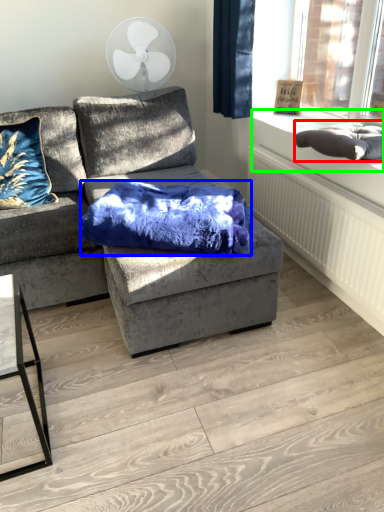
Question: Estimate the real-world distances between objects in this image. Which object is closer to material (highlighted by a red box), blanket (highlighted by a blue box) or window sill (highlighted by a green box)?

Choices:
 (A) blanket
 (B) window sill

Answer: (B)